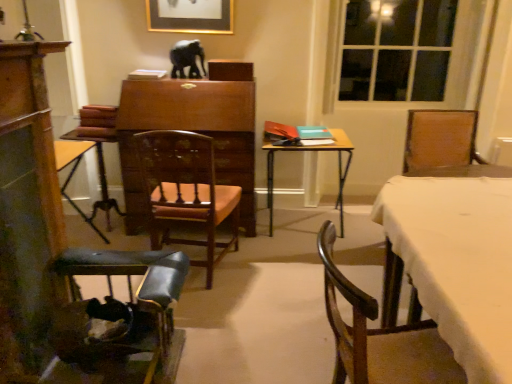
What do you see at coordinates (313, 152) in the screenshot? I see `wooden table at center` at bounding box center [313, 152].

What do you see at coordinates (117, 318) in the screenshot?
I see `metallic blue chair at lower left, the 3th chair in the right-to-left sequence` at bounding box center [117, 318].

The image size is (512, 384). What do you see at coordinates (27, 212) in the screenshot?
I see `wooden dresser at left` at bounding box center [27, 212].

At what (x,y) coordinates should I click in order to perform the action: click on wooden table at center. Please return your answer as a coordinate pair (x, y). Looking at the image, I should click on (313, 152).

Which object is more forward, wooden armchair at center or matte gold picture frame at upper center?

Positioned in front is wooden armchair at center.

From the image's perspective, relative to matte gold picture frame at upper center, is wooden armchair at center above or below?

Clearly, from the image's perspective, wooden armchair at center is below matte gold picture frame at upper center.

Is point (115, 134) closer or farther from the camera than point (176, 16)?

Point (115, 134) is positioned closer to the camera compared to point (176, 16).

Can you tell me how much wooden armchair at center and matte gold picture frame at upper center differ in facing direction?

The angular difference between wooden armchair at center and matte gold picture frame at upper center is 2.97 degrees.

Considering the relative positions of wooden polished chair at center, which is the 2th chair from right to left, and matte gold picture frame at upper center in the image provided, is wooden polished chair at center, which is the 2th chair from right to left, to the right of matte gold picture frame at upper center from the viewer's perspective?

Yes, wooden polished chair at center, which is the 2th chair from right to left, is to the right of matte gold picture frame at upper center.

From a real-world perspective, is wooden polished chair at center, which is the 2th chair from right to left, on top of matte gold picture frame at upper center?

Incorrect, from a real-world perspective, wooden polished chair at center, which is the 2th chair from right to left, is lower than matte gold picture frame at upper center.

Are wooden polished chair at center, which is the 2th chair from right to left, and matte gold picture frame at upper center far apart?

Absolutely, wooden polished chair at center, which is the 2th chair from right to left, is distant from matte gold picture frame at upper center.

Consider the image. Are wooden table at center and wooden chair at lower right, the third chair positioned from the left, beside each other?

No, wooden table at center is not with wooden chair at lower right, the third chair positioned from the left.

From the image's perspective, is wooden table at center beneath wooden chair at lower right, the 1th chair positioned from the right?

No.

Considering the relative positions of wooden table at center and wooden chair at lower right, the third chair positioned from the left, in the image provided, is wooden table at center to the left or to the right of wooden chair at lower right, the third chair positioned from the left,?

wooden table at center is to the left of wooden chair at lower right, the third chair positioned from the left.

Can you confirm if shiny black elephant at center is positioned to the right of wooden table at center?

In fact, shiny black elephant at center is to the left of wooden table at center.

From the image's perspective, is shiny black elephant at center above wooden table at center?

Correct, shiny black elephant at center appears higher than wooden table at center in the image.

From a real-world perspective, is shiny black elephant at center located beneath wooden table at center?

No, from a real-world perspective, shiny black elephant at center is not below wooden table at center.

How many degrees apart are the facing directions of shiny black elephant at center and wooden table at center?

shiny black elephant at center and wooden table at center are facing 0.74 degrees away from each other.

From a real-world perspective, is wooden table at center above or below white cloth-covered table at right?

wooden table at center is situated lower than white cloth-covered table at right in the real world.

Consider the image. Between wooden table at center and white cloth-covered table at right, which one has smaller width?

wooden table at center.

How many degrees apart are the facing directions of wooden table at center and white cloth-covered table at right?

The facing directions of wooden table at center and white cloth-covered table at right are 88.5 degrees apart.

The image size is (512, 384). I want to click on desk in front of the wooden table at center, so click(453, 260).

Starting from the wooden armchair at center, which chair is the 1st one to the right? Please provide its 2D coordinates.

[(117, 318)]

Is metallic blue chair at lower left, the 3th chair in the right-to-left sequence, taller than wooden armchair at center?

No.

Considering the points (64, 379) and (97, 121), which point is in front, point (64, 379) or point (97, 121)?

The point (64, 379) is closer.

In terms of width, does metallic blue chair at lower left, the 3th chair in the right-to-left sequence, look wider or thinner when compared to wooden armchair at center?

Considering their sizes, metallic blue chair at lower left, the 3th chair in the right-to-left sequence, looks broader than wooden armchair at center.

Consider the image. Considering the relative sizes of wooden armchair at center and shiny black elephant at center in the image provided, is wooden armchair at center thinner than shiny black elephant at center?

No.

Is wooden armchair at center turned away from shiny black elephant at center?

No, wooden armchair at center's orientation is not away from shiny black elephant at center.

Is wooden armchair at center next to shiny black elephant at center and touching it?

No, wooden armchair at center is not touching shiny black elephant at center.

This screenshot has width=512, height=384. What are the coordinates of `armchair in front of the matte gold picture frame at upper center` in the screenshot? It's located at (98, 149).

Where is `picture frame lying above the wooden polished chair at center, the 2th chair from the left (from the image's perspective)`? picture frame lying above the wooden polished chair at center, the 2th chair from the left (from the image's perspective) is located at coordinates (190, 16).

When comparing their distances from metallic blue chair at lower left, the 3th chair in the right-to-left sequence, does wooden polished chair at center, the 2th chair from the left, or white cloth-covered table at right seem closer?

Among the two, wooden polished chair at center, the 2th chair from the left, is located nearer to metallic blue chair at lower left, the 3th chair in the right-to-left sequence.

From the image, which object appears to be nearer to wooden table at center, wooden dresser at left or matte gold picture frame at upper center?

Among the two, matte gold picture frame at upper center is located nearer to wooden table at center.

Looking at this image, considering their positions, is wooden polished chair at center, the 2th chair from the left, positioned further to wooden chair at lower right, the third chair positioned from the left, than shiny black elephant at center?

Among the two, shiny black elephant at center is located further to wooden chair at lower right, the third chair positioned from the left.

Which object lies nearer to the anchor point metallic blue chair at lower left, the 3th chair in the right-to-left sequence, shiny black elephant at center or wooden chair at lower right, the 1th chair positioned from the right?

wooden chair at lower right, the 1th chair positioned from the right, is positioned closer to the anchor metallic blue chair at lower left, the 3th chair in the right-to-left sequence.

From the image, which object appears to be nearer to wooden dresser at left, wooden polished chair at center, the 2th chair from the left, or shiny black elephant at center?

Among the two, wooden polished chair at center, the 2th chair from the left, is located nearer to wooden dresser at left.

In the scene shown: Which object lies further to the anchor point metallic blue chair at lower left, which is counted as the first chair, starting from the left, wooden polished chair at center, the 2th chair from the left, or wooden table at center?

Among the two, wooden table at center is located further to metallic blue chair at lower left, which is counted as the first chair, starting from the left.

Consider the image. Looking at the image, which one is located closer to matte gold picture frame at upper center, metallic blue chair at lower left, the 3th chair in the right-to-left sequence, or shiny black elephant at center?

The object closer to matte gold picture frame at upper center is shiny black elephant at center.

When comparing their distances from wooden dresser at left, does matte gold picture frame at upper center or wooden polished chair at center, the 2th chair from the left, seem closer?

wooden polished chair at center, the 2th chair from the left, is positioned closer to the anchor wooden dresser at left.

You are a GUI agent. You are given a task and a screenshot of the screen. Output one action in this format:
    pyautogui.click(x=<x>, y=<y>)
    Task: Click on the armchair between shiny black elephant at center and wooden polished chair at center, the 2th chair from the left, in the vertical direction
    Image resolution: width=512 pixels, height=384 pixels.
    Given the screenshot: What is the action you would take?
    pyautogui.click(x=98, y=149)

Identify the location of animal that lies between matte gold picture frame at upper center and wooden armchair at center from top to bottom. (187, 58).

Find the location of a particular element. Image resolution: width=512 pixels, height=384 pixels. armchair between matte gold picture frame at upper center and wooden polished chair at center, the 2th chair from the left, from top to bottom is located at coordinates (98, 149).

Identify the location of armchair between white cloth-covered table at right and shiny black elephant at center from front to back. The width and height of the screenshot is (512, 384). point(98,149).